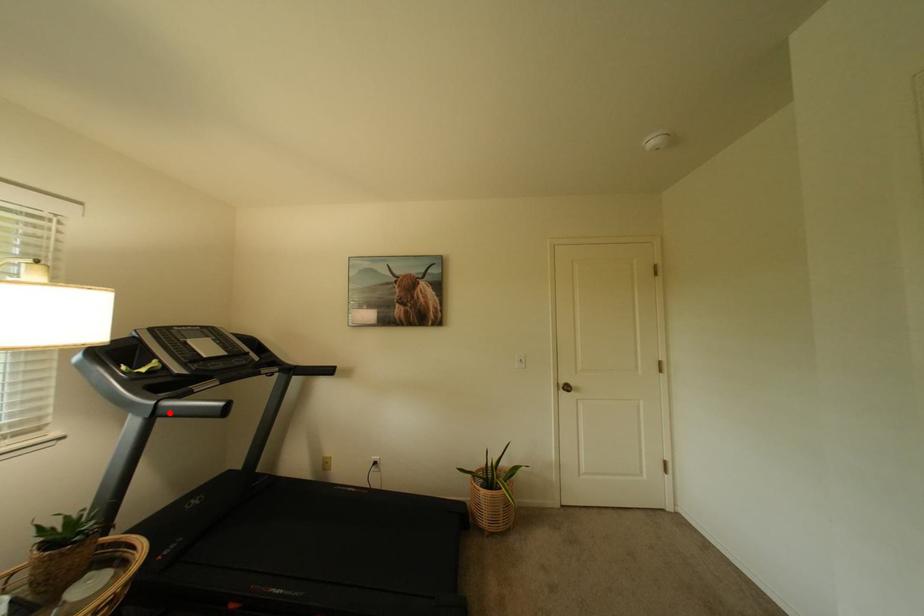
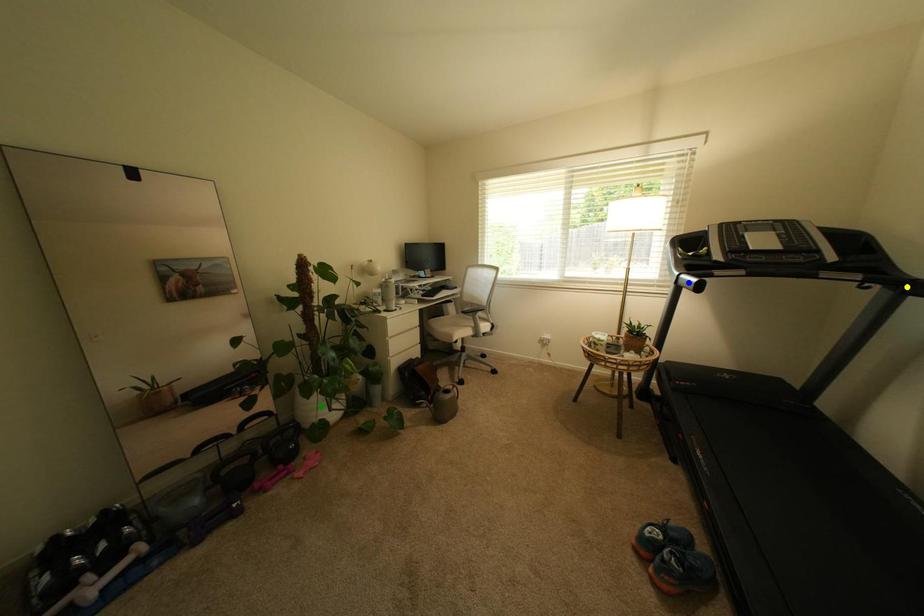
Question: I am providing you with two images of the same scene from different viewpoints. A red point is marked on the first image. You are given multiple points on the second image. Can you choose the point in image 2 that corresponds to the point in image 1?

Choices:
 (A) blue point
 (B) green point
 (C) yellow point

Answer: (A)